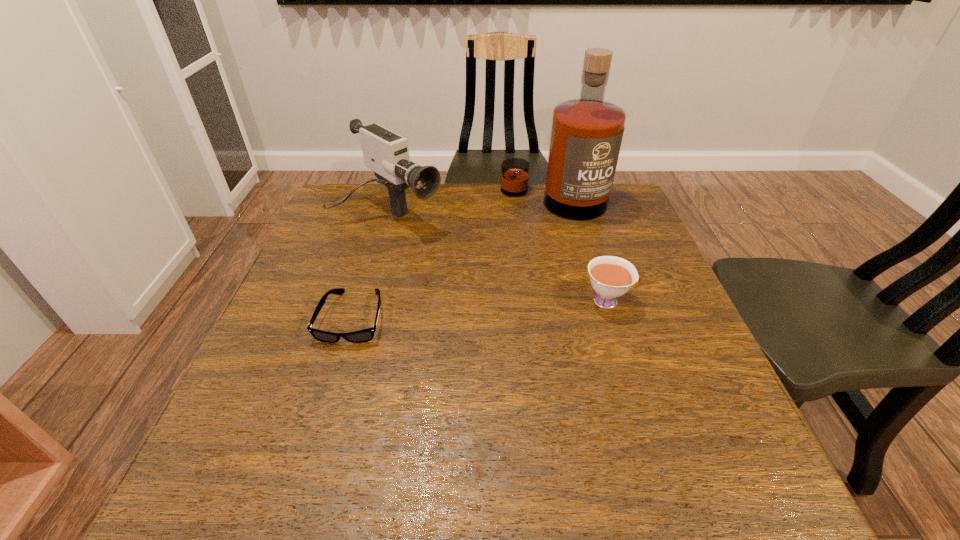
Locate an element on the screen. Image resolution: width=960 pixels, height=540 pixels. vacant space on the desktop that is between the sunglasses and the teacup and is positioned on the recording direction of the second tallest object is located at coordinates (521, 306).

Where is `vacant space on the desktop that is between the sunglasses and the third tallest object and is positioned on the front label of the tallest object`? This screenshot has height=540, width=960. vacant space on the desktop that is between the sunglasses and the third tallest object and is positioned on the front label of the tallest object is located at coordinates (516, 307).